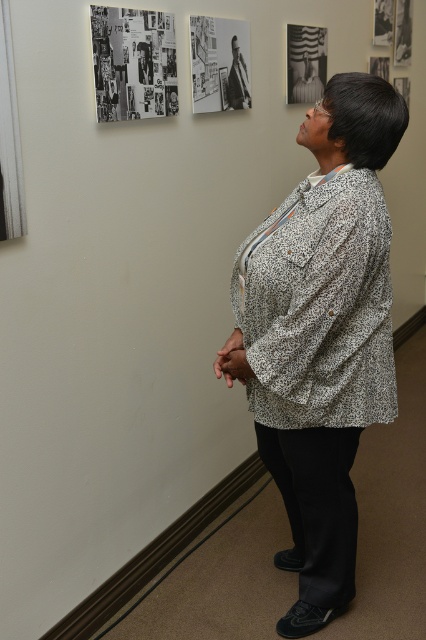
Who is lower down, black paper collage at upper left or metallic silver frame at upper center?

Positioned lower is black paper collage at upper left.

Does black paper collage at upper left appear over metallic silver frame at upper center?

Incorrect, black paper collage at upper left is not positioned above metallic silver frame at upper center.

Is point (103, 42) positioned in front of point (298, 86)?

Yes, point (103, 42) is in front of point (298, 86).

Locate an element on the screen. black paper collage at upper left is located at coordinates (132, 61).

Which of these two, white printed shirt at center or black paper collage at upper left, stands shorter?

black paper collage at upper left is shorter.

Is white printed shirt at center smaller than black paper collage at upper left?

Incorrect, white printed shirt at center is not smaller in size than black paper collage at upper left.

Is point (282, 374) farther from viewer compared to point (106, 108)?

No, it is not.

Locate an element on the screen. white printed shirt at center is located at coordinates (321, 336).

Can you confirm if black and white photograph at upper center is positioned above metallic silver frame at upper center?

Actually, black and white photograph at upper center is below metallic silver frame at upper center.

Is point (210, 96) less distant than point (322, 51)?

Yes, it is.

What are the coordinates of `black and white photograph at upper center` in the screenshot? It's located at (218, 64).